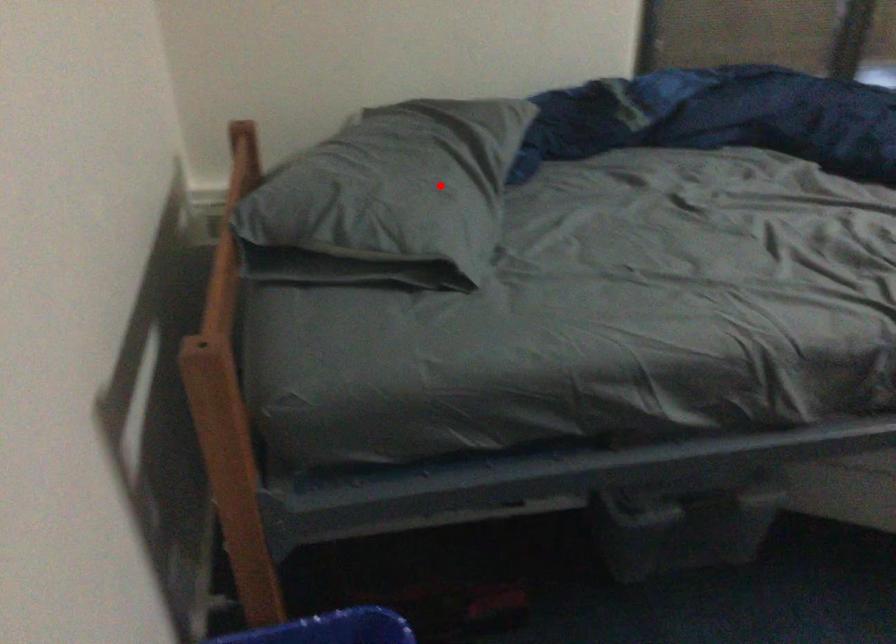
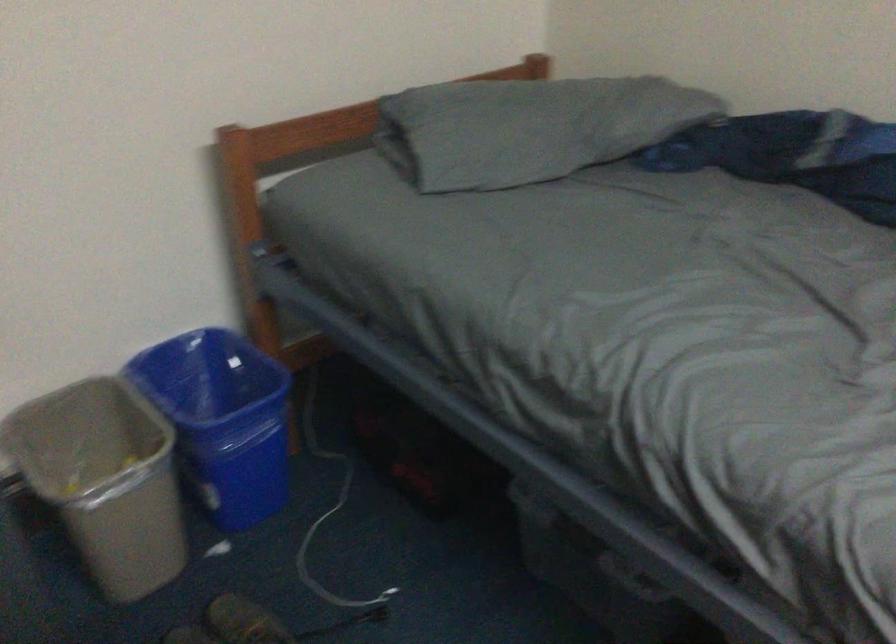
Locate, in the second image, the point that corresponds to the highlighted location in the first image.

(529, 128)